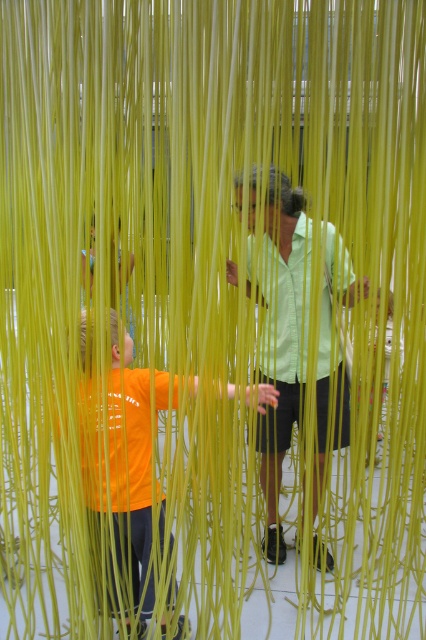
Question: Among these objects, which one is nearest to the camera?

Choices:
 (A) green textured shirt at center
 (B) light green shirt at center
 (C) orange matte shirt at center

Answer: (C)

Question: Is orange matte shirt at center thinner than green textured shirt at center?

Choices:
 (A) no
 (B) yes

Answer: (A)

Question: Is light green shirt at center positioned behind green textured shirt at center?

Choices:
 (A) no
 (B) yes

Answer: (A)

Question: Is light green shirt at center positioned behind green textured shirt at center?

Choices:
 (A) no
 (B) yes

Answer: (A)

Question: Which point is farther from the camera taking this photo?

Choices:
 (A) (288, 371)
 (B) (126, 384)

Answer: (A)

Question: Among these objects, which one is nearest to the camera?

Choices:
 (A) light green shirt at center
 (B) orange matte shirt at center

Answer: (B)